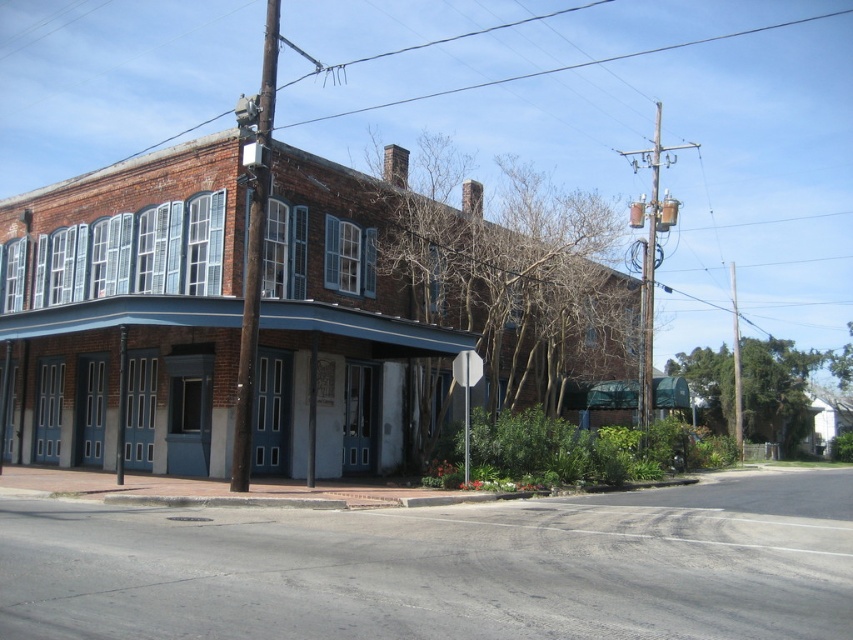
You are a delivery driver approaching the corner building. You need to know if the white glossy stop sign at center is shorter than the brown wooden pole at upper center to plan your route. Can you confirm this?

The brown wooden pole at upper center is taller than the white glossy stop sign at center, so yes, the white glossy stop sign at center is shorter than the brown wooden pole at upper center.

You are a pedestrian standing on the sidewalk in front of the building. You notice a brown wooden pole at upper center and a white glossy stop sign at center. Which object is closer to you?

The brown wooden pole at upper center is closer to you because it is in front of the white glossy stop sign at center.

You are a pedestrian standing on the sidewalk in front of the building. You see the brown wooden pole at upper center and the white glossy stop sign at center. Which object is located above the other?

The brown wooden pole at upper center is positioned over the white glossy stop sign at center, so it is above the stop sign.